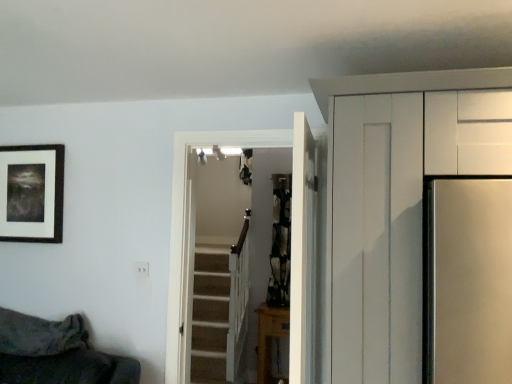
At what (x,y) coordinates should I click in order to perform the action: click on wooden table at lower center. Please return your answer as a coordinate pair (x, y). The image size is (512, 384). Looking at the image, I should click on (269, 337).

The height and width of the screenshot is (384, 512). Identify the location of white wooden door at center, the second door when ordered from back to front. (302, 255).

Where is `white wooden door at center, acting as the first door starting from the back`? white wooden door at center, acting as the first door starting from the back is located at coordinates click(292, 244).

Describe the element at coordinates (31, 193) in the screenshot. I see `black matte picture frame at upper left` at that location.

Where is `black matte picture frame at upper left`? This screenshot has width=512, height=384. black matte picture frame at upper left is located at coordinates (x=31, y=193).

Find the location of a particular element. The image size is (512, 384). wooden table at lower center is located at coordinates (269, 337).

Is white wooden door at center, the 1th door viewed from the front, completely or partially outside of white wooden door at center, acting as the first door starting from the back?

Yes, white wooden door at center, the 1th door viewed from the front, is not within white wooden door at center, acting as the first door starting from the back.

The height and width of the screenshot is (384, 512). In order to click on door directly beneath the white wooden door at center, the second door when ordered from back to front (from a real-world perspective) in this screenshot , I will do `click(292, 244)`.

Is white wooden door at center, the 1th door viewed from the front, turned away from white wooden door at center, acting as the first door starting from the back?

No, white wooden door at center, the 1th door viewed from the front, is not facing away from white wooden door at center, acting as the first door starting from the back.

Is white wooden door at center, the 1th door viewed from the front, facing towards wooden table at lower center?

No, white wooden door at center, the 1th door viewed from the front, is not oriented towards wooden table at lower center.

Which is in front, point (294, 336) or point (264, 335)?

The point (294, 336) is closer to the camera.

From a real-world perspective, between white wooden door at center, the second door when ordered from back to front, and wooden table at lower center, who is vertically higher?

white wooden door at center, the second door when ordered from back to front.

Are white wooden door at center, the 1th door viewed from the front, and wooden table at lower center far apart?

That's right, there is a large distance between white wooden door at center, the 1th door viewed from the front, and wooden table at lower center.

Is there a large distance between white wooden door at center, acting as the first door starting from the back, and black matte picture frame at upper left?

Yes.

Consider the image. Can you confirm if white wooden door at center, the second door from the front, is smaller than black matte picture frame at upper left?

Incorrect, white wooden door at center, the second door from the front, is not smaller in size than black matte picture frame at upper left.

From the image's perspective, is white wooden door at center, the second door when ordered from back to front, on black matte picture frame at upper left?

Incorrect, from the image's perspective, white wooden door at center, the second door when ordered from back to front, is lower than black matte picture frame at upper left.

Is white wooden door at center, the second door when ordered from back to front, positioned behind black matte picture frame at upper left?

No, it is not.

From a real-world perspective, is white wooden door at center, the 1th door viewed from the front, positioned above or below black matte picture frame at upper left?

white wooden door at center, the 1th door viewed from the front, is below black matte picture frame at upper left.

Is white wooden door at center, the 1th door viewed from the front, bigger than black matte picture frame at upper left?

Yes, white wooden door at center, the 1th door viewed from the front, is bigger than black matte picture frame at upper left.

Can we say wooden table at lower center lies outside white wooden door at center, the second door when ordered from back to front?

That's correct, wooden table at lower center is outside of white wooden door at center, the second door when ordered from back to front.

From the wooden table at lower center, count the 1st door to the left and point to it. Please provide its 2D coordinates.

[(302, 255)]

Looking at this image, from a real-world perspective, is wooden table at lower center under white wooden door at center, the second door when ordered from back to front?

Yes, from a real-world perspective, wooden table at lower center is under white wooden door at center, the second door when ordered from back to front.

Does point (3, 202) come farther from viewer compared to point (266, 375)?

No, (3, 202) is in front of (266, 375).

From the image's perspective, which is below, black matte picture frame at upper left or wooden table at lower center?

wooden table at lower center is shown below in the image.

Considering the relative sizes of black matte picture frame at upper left and wooden table at lower center in the image provided, is black matte picture frame at upper left thinner than wooden table at lower center?

Yes.

Is point (179, 369) closer to camera compared to point (312, 150)?

No, (179, 369) is further to viewer.

Considering the positions of objects white wooden door at center, acting as the first door starting from the back, and white wooden door at center, the second door when ordered from back to front, in the image provided, who is more to the left, white wooden door at center, acting as the first door starting from the back, or white wooden door at center, the second door when ordered from back to front,?

Positioned to the left is white wooden door at center, acting as the first door starting from the back.

Is white wooden door at center, the second door from the front, smaller than white wooden door at center, the second door when ordered from back to front?

Incorrect, white wooden door at center, the second door from the front, is not smaller in size than white wooden door at center, the second door when ordered from back to front.

You are a GUI agent. You are given a task and a screenshot of the screen. Output one action in this format:
    pyautogui.click(x=<x>, y=<y>)
    Task: Click on the door above the white wooden door at center, the second door from the front (from the image's perspective)
    
    Given the screenshot: What is the action you would take?
    pyautogui.click(x=302, y=255)

In the image, there is a white wooden door at center, the 1th door viewed from the front. In order to click on door below it (from a real-world perspective) in this screenshot , I will do `click(292, 244)`.

This screenshot has height=384, width=512. I want to click on the 2nd door above the wooden table at lower center (from the image's perspective), so click(x=302, y=255).

From the image, which object appears to be farther from white wooden door at center, the second door from the front, white wooden door at center, the 1th door viewed from the front, or wooden table at lower center?

The object further to white wooden door at center, the second door from the front, is wooden table at lower center.

Looking at the image, which one is located further to white wooden door at center, the second door from the front, white wooden door at center, the 1th door viewed from the front, or black matte picture frame at upper left?

black matte picture frame at upper left is positioned further to the anchor white wooden door at center, the second door from the front.

Estimate the real-world distances between objects in this image. Which object is closer to wooden table at lower center, white wooden door at center, acting as the first door starting from the back, or black matte picture frame at upper left?

white wooden door at center, acting as the first door starting from the back, is closer to wooden table at lower center.

Considering their positions, is black matte picture frame at upper left positioned closer to white wooden door at center, the 1th door viewed from the front, than white wooden door at center, acting as the first door starting from the back?

white wooden door at center, acting as the first door starting from the back.

Considering their positions, is white wooden door at center, the second door from the front, positioned further to black matte picture frame at upper left than white wooden door at center, the 1th door viewed from the front?

Based on the image, white wooden door at center, the 1th door viewed from the front, appears to be further to black matte picture frame at upper left.

Based on their spatial positions, is white wooden door at center, the 1th door viewed from the front, or white wooden door at center, the second door from the front, further from black matte picture frame at upper left?

white wooden door at center, the 1th door viewed from the front.

Which object lies nearer to the anchor point wooden table at lower center, white wooden door at center, acting as the first door starting from the back, or white wooden door at center, the second door when ordered from back to front?

white wooden door at center, acting as the first door starting from the back, lies closer to wooden table at lower center than the other object.

Based on the photo, based on their spatial positions, is black matte picture frame at upper left or wooden table at lower center closer to white wooden door at center, acting as the first door starting from the back?

The object closer to white wooden door at center, acting as the first door starting from the back, is black matte picture frame at upper left.

Locate an element on the screen. This screenshot has height=384, width=512. door between white wooden door at center, the 1th door viewed from the front, and wooden table at lower center in the front-back direction is located at coordinates tap(292, 244).

Locate an element on the screen. picture frame between white wooden door at center, the 1th door viewed from the front, and wooden table at lower center from front to back is located at coordinates (31, 193).

The height and width of the screenshot is (384, 512). What are the coordinates of `door between black matte picture frame at upper left and white wooden door at center, the second door when ordered from back to front, in the horizontal direction` in the screenshot? It's located at (292, 244).

Locate an element on the screen. picture frame between white wooden door at center, acting as the first door starting from the back, and wooden table at lower center, along the z-axis is located at coordinates (31, 193).